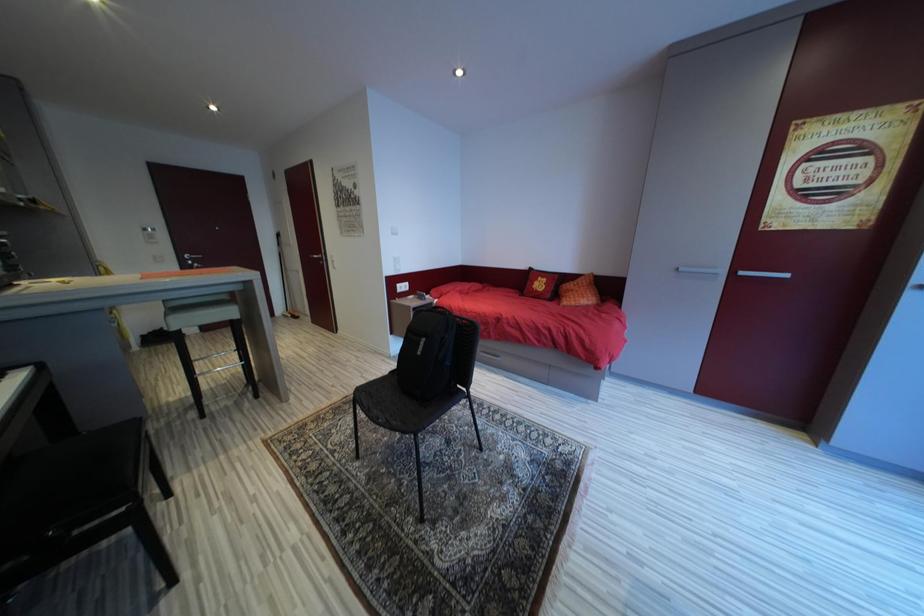
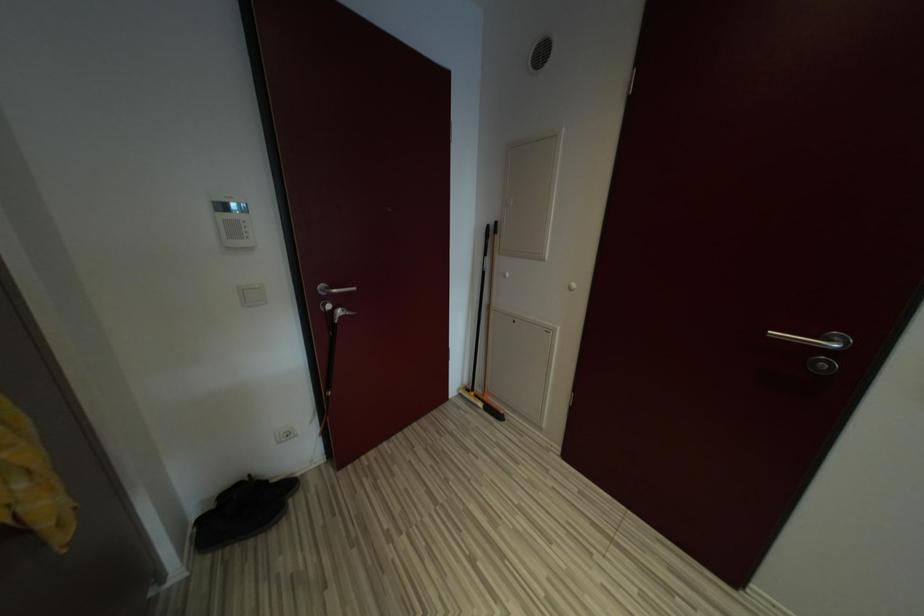
In the scene shown: The images are taken continuously from a first-person perspective. In which direction are you moving?

The cameraman moved toward left, forward.